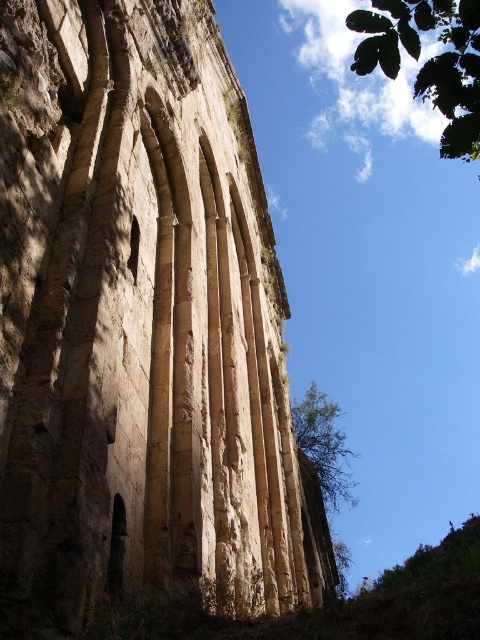
Question: Estimate the real-world distances between objects in this image. Which object is farther from the rustic stone arches at center?

Choices:
 (A) green leafy tree at center
 (B) green leafy tree at upper right

Answer: (A)

Question: In this image, where is green leafy tree at upper right located relative to green leafy tree at center?

Choices:
 (A) left
 (B) right

Answer: (B)

Question: Which point is closer to the camera?

Choices:
 (A) click(479, 99)
 (B) click(108, 337)

Answer: (A)

Question: Is rustic stone arches at center behind green leafy tree at upper right?

Choices:
 (A) no
 (B) yes

Answer: (A)

Question: Which object is farther from the camera taking this photo?

Choices:
 (A) green leafy tree at center
 (B) rustic stone arches at center

Answer: (A)

Question: Is green leafy tree at upper right to the left of green leafy tree at center from the viewer's perspective?

Choices:
 (A) no
 (B) yes

Answer: (A)